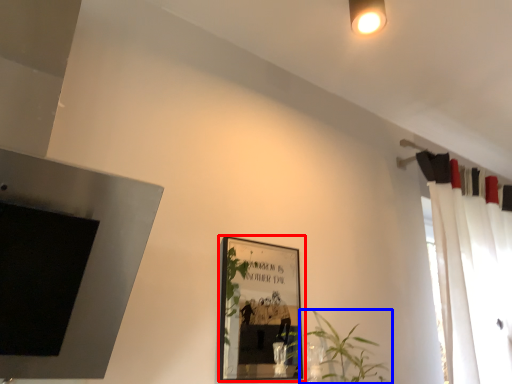
Question: Which of the following is the farthest to the observer, picture frame (highlighted by a red box) or houseplant (highlighted by a blue box)?

Choices:
 (A) picture frame
 (B) houseplant

Answer: (B)